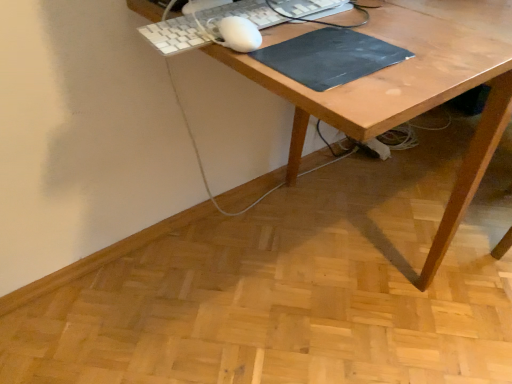
This screenshot has height=384, width=512. Find the location of `vacant space to the right of white plastic keyboard at upper center`. vacant space to the right of white plastic keyboard at upper center is located at coordinates (400, 29).